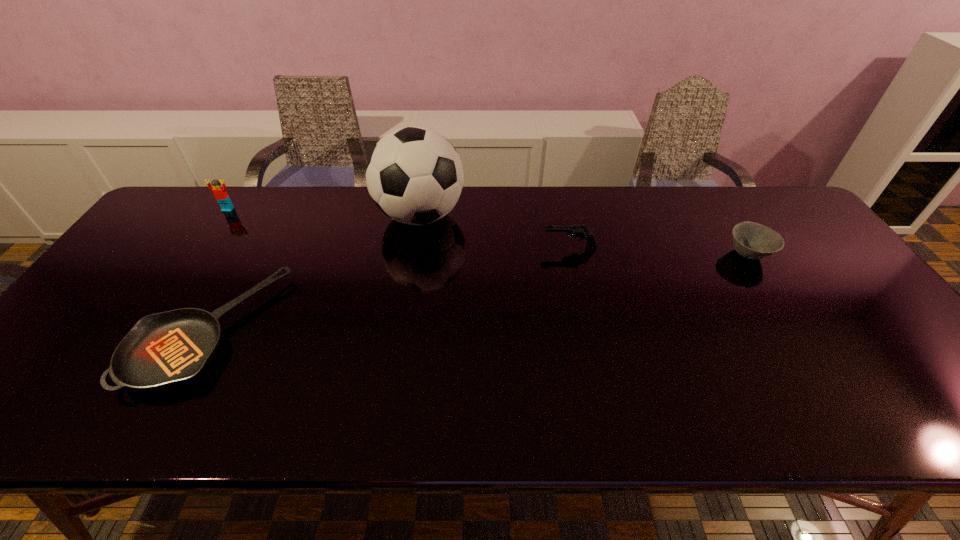
This screenshot has width=960, height=540. I want to click on the third object from right to left, so click(x=414, y=175).

You are a GUI agent. You are given a task and a screenshot of the screen. Output one action in this format:
    pyautogui.click(x=<x>, y=<y>)
    Task: Click on the tallest object
    The image size is (960, 540).
    Given the screenshot: What is the action you would take?
    pyautogui.click(x=414, y=175)

Where is `Lego`? Image resolution: width=960 pixels, height=540 pixels. Lego is located at coordinates (221, 195).

Image resolution: width=960 pixels, height=540 pixels. I want to click on gun, so click(579, 232).

Where is `the fourth object from left to right`? the fourth object from left to right is located at coordinates (579, 232).

Locate an element on the screen. the rightmost object is located at coordinates (754, 241).

Where is `bowl`? bowl is located at coordinates (754, 241).

At what (x,y) coordinates should I click in order to perform the action: click on frying pan. Please return your answer as a coordinate pair (x, y). Looking at the image, I should click on (161, 350).

The height and width of the screenshot is (540, 960). Identify the location of the shortest object. (161, 350).

This screenshot has height=540, width=960. What are the coordinates of `vacant space located 0.340m on the left of the third object from left to right` in the screenshot? It's located at (267, 215).